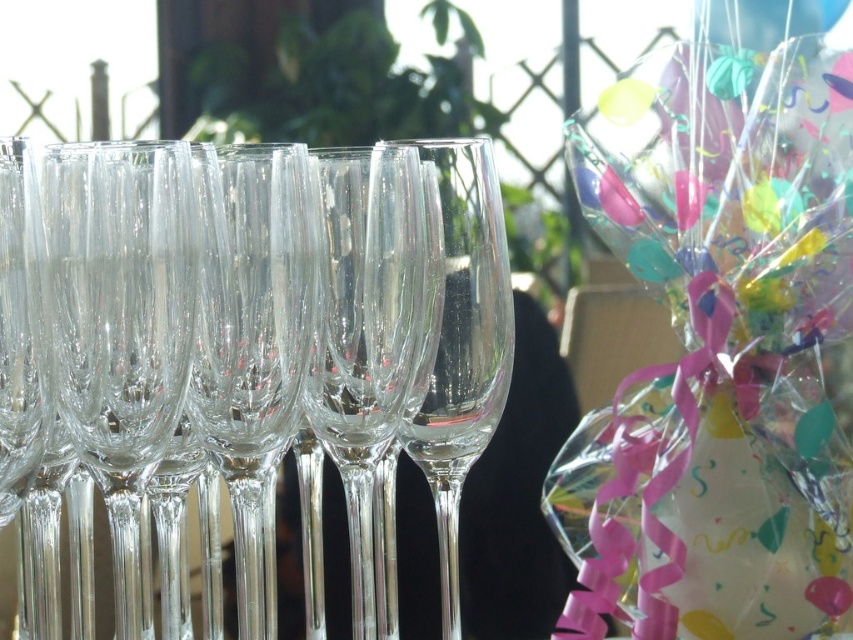
Can you confirm if transparent crystal wine glass at center is positioned below transparent glass wine glass at center?

Correct, transparent crystal wine glass at center is located below transparent glass wine glass at center.

Between transparent crystal wine glass at center and transparent glass wine glass at center, which one has more height?

transparent glass wine glass at center

What do you see at coordinates (372, 326) in the screenshot?
I see `transparent crystal wine glass at center` at bounding box center [372, 326].

What are the coordinates of `transparent crystal wine glass at center` in the screenshot? It's located at (372, 326).

Which is behind, point (831, 305) or point (67, 403)?

Positioned behind is point (831, 305).

At what (x,y) coordinates should I click in order to perform the action: click on translucent plastic balloon at upper right. Please return your answer as a coordinate pair (x, y). Looking at the image, I should click on (718, 349).

Describe the element at coordinates (718, 349) in the screenshot. I see `translucent plastic balloon at upper right` at that location.

Does translucent plastic balloon at upper right lie in front of transparent glass wine glass at center?

Yes, translucent plastic balloon at upper right is in front of transparent glass wine glass at center.

Where is `translucent plastic balloon at upper right`? The image size is (853, 640). translucent plastic balloon at upper right is located at coordinates (718, 349).